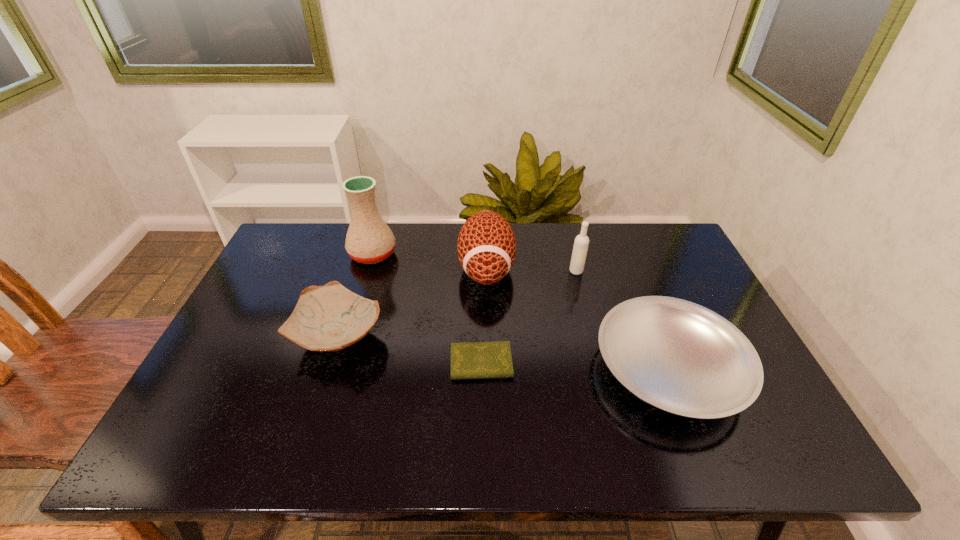
Find the location of `vacant area situated on the right of the football`. vacant area situated on the right of the football is located at coordinates (604, 268).

Find the location of a particular element. vacant space located on the back of the nearer pottery is located at coordinates (372, 236).

Image resolution: width=960 pixels, height=540 pixels. I want to click on vacant region located 0.050m on the front of the bedpan, so click(x=706, y=460).

Where is `free space located on the back of the shortest object`? The height and width of the screenshot is (540, 960). free space located on the back of the shortest object is located at coordinates 481,301.

At what (x,y) coordinates should I click in order to perform the action: click on pottery that is positioned at the far edge. Please return your answer as a coordinate pair (x, y). Looking at the image, I should click on (369, 240).

The width and height of the screenshot is (960, 540). Identify the location of vodka located at the far edge. (581, 243).

In order to click on football at the far edge in this screenshot , I will do `click(486, 246)`.

Locate an element on the screen. The height and width of the screenshot is (540, 960). object that is at the near edge is located at coordinates (678, 356).

Identify the location of object at the right edge. pos(678,356).

Locate an element on the screen. This screenshot has width=960, height=540. object located in the near right corner section of the desktop is located at coordinates (678, 356).